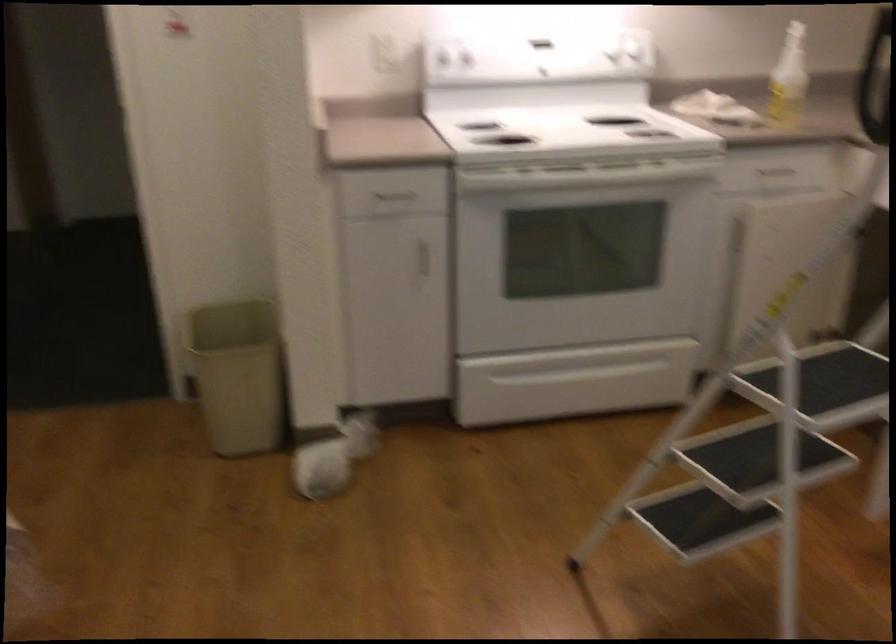
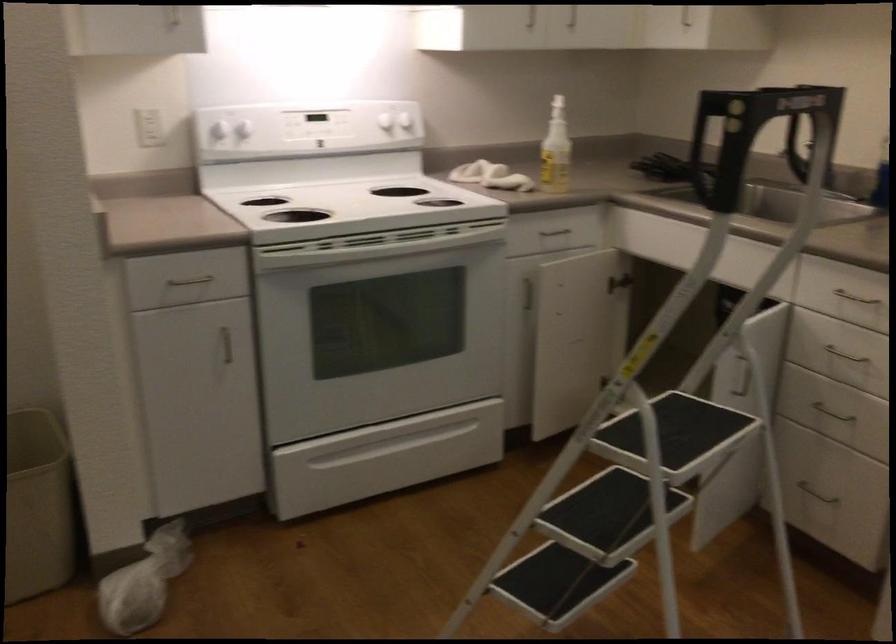
The images are taken continuously from a first-person perspective. In which direction are you moving?

The cameraman moved toward left, forward.